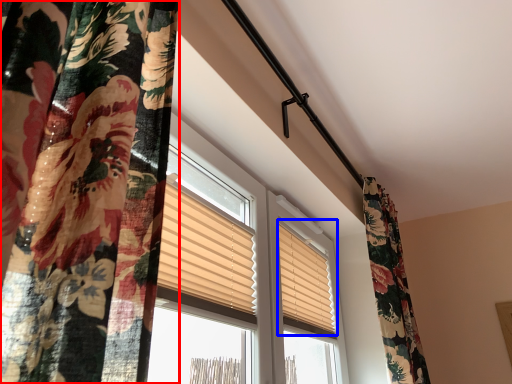
Question: Which of the following is the farthest to the observer, curtain (highlighted by a red box) or window blind (highlighted by a blue box)?

Choices:
 (A) curtain
 (B) window blind

Answer: (B)